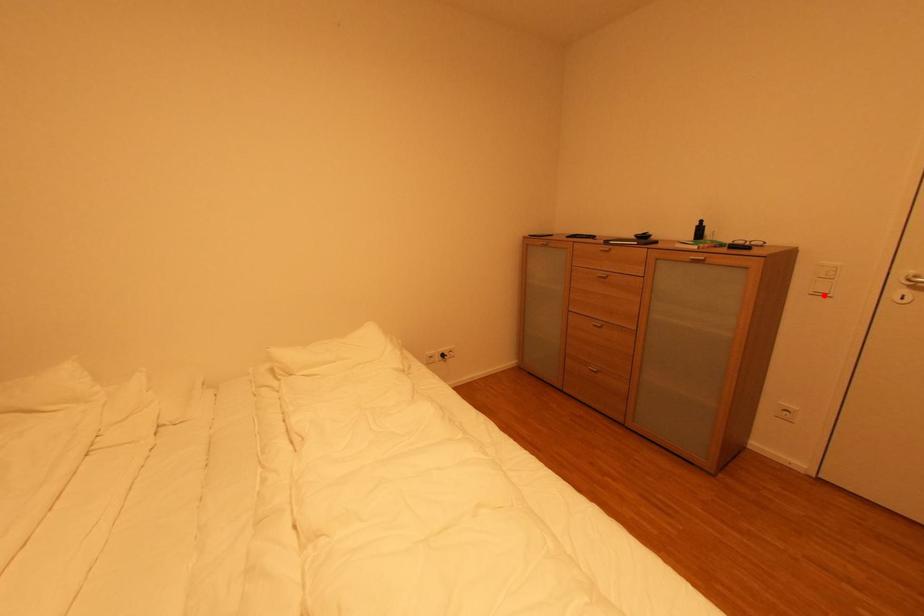
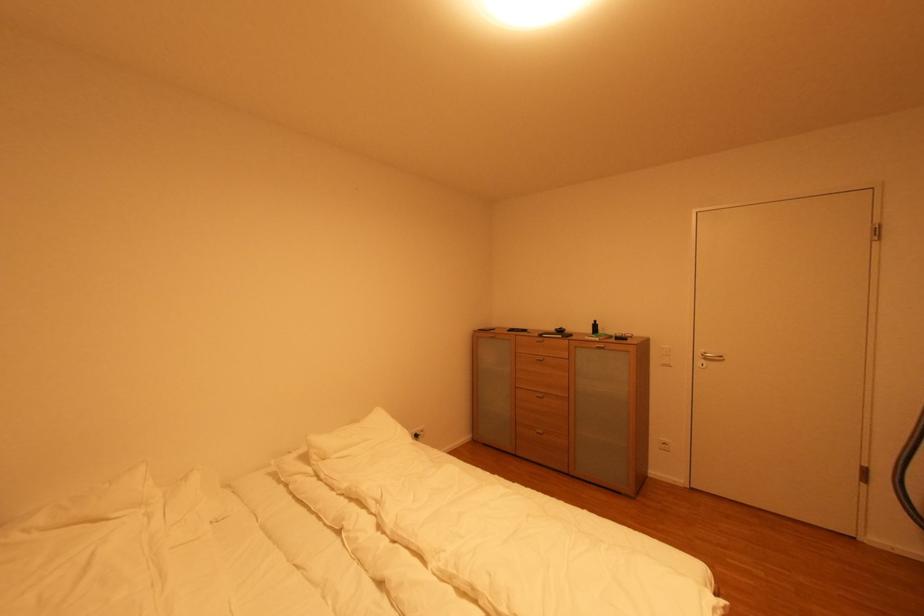
Question: I am providing you with two images of the same scene from different viewpoints. A red point is marked on the first image. Can you still see the location of the red point in image 2?

Choices:
 (A) Yes
 (B) No

Answer: (A)